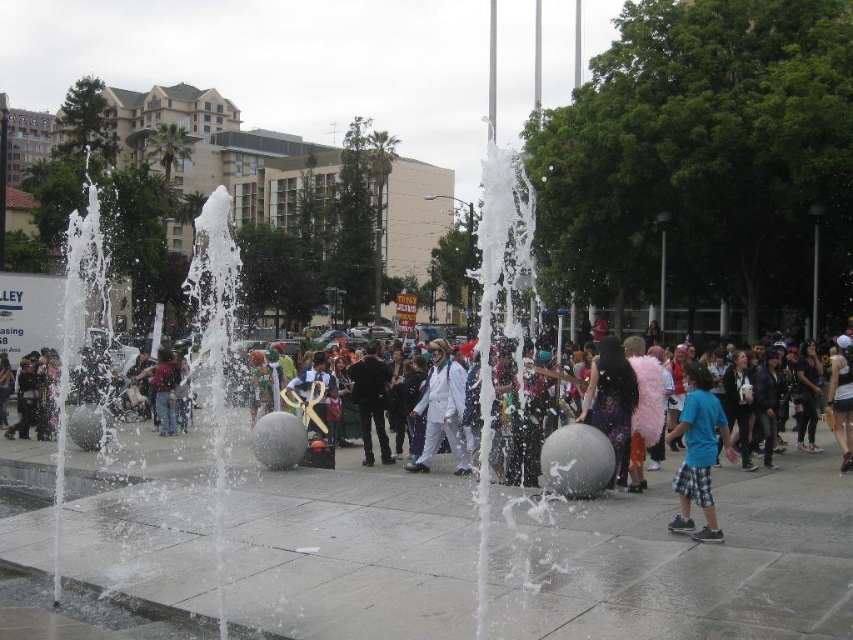
You are a photographer trying to capture a candid shot of the white matte suit at center and the blue plaid shorts at lower right. Which of the two subjects is narrower in width?

The blue plaid shorts at lower right is thinner than the white matte suit at center, so the blue plaid shorts at lower right is narrower in width.

You are a photographer standing in the plaza and want to take a photo of the fountain. You notice a white fluffy coat at center and a white matte suit at center. Which object is closer to the camera?

The white fluffy coat at center is positioned under the white matte suit at center, so the white fluffy coat at center is closer to the camera.

In the scene shown: You are standing in the plaza and want to take a photo of the white matte suit at center. You notice the blue plaid shorts at lower right is blocking your view. Can you move to the left or right to avoid the obstruction?

The blue plaid shorts at lower right is closer to the viewer than the white matte suit at center, so moving to the left or right might not help as the obstruction is in front of the subject. Consider moving forward or backward instead.